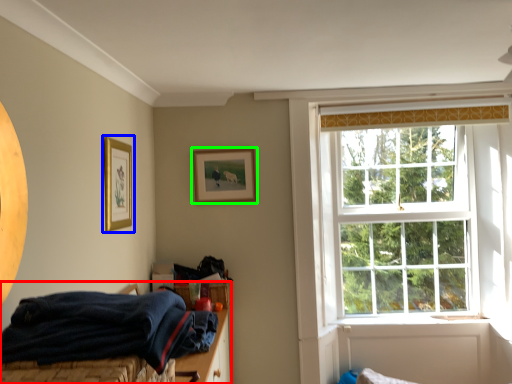
Question: Which object is the closest to the bed (highlighted by a red box)? Choose among these: picture frame (highlighted by a blue box) or picture frame (highlighted by a green box).

Choices:
 (A) picture frame
 (B) picture frame

Answer: (B)